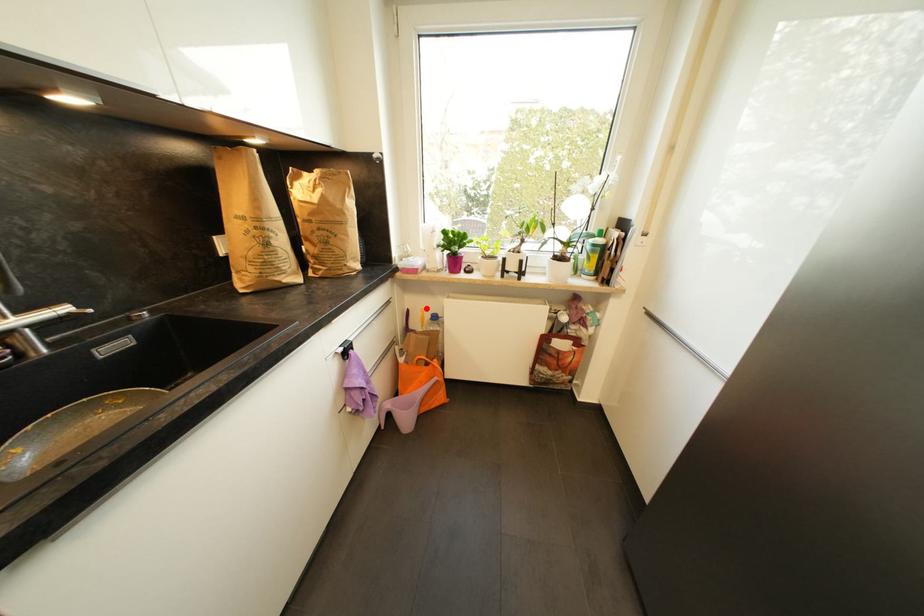
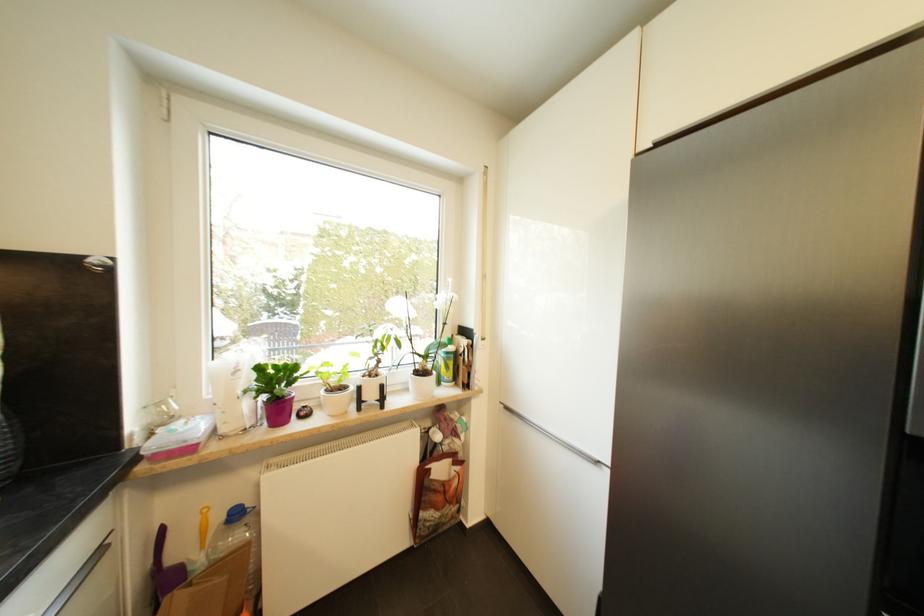
Find the pixel in the second image that matches the highlighted location in the first image.

(207, 507)